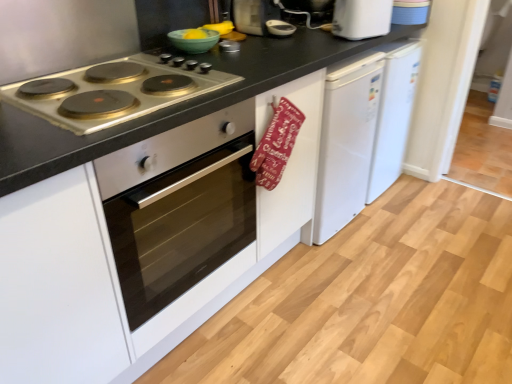
The height and width of the screenshot is (384, 512). What do you see at coordinates (361, 18) in the screenshot?
I see `white plastic toaster at upper right` at bounding box center [361, 18].

What do you see at coordinates (193, 41) in the screenshot? The image size is (512, 384). I see `green matte bowl at upper center` at bounding box center [193, 41].

Locate an element on the screen. white plastic toaster at upper right is located at coordinates (361, 18).

From the image's perspective, which object appears higher, white plastic toaster at upper right or red fabric oven mitt at center?

From the image's view, white plastic toaster at upper right is above.

From a real-world perspective, who is located lower, white plastic toaster at upper right or red fabric oven mitt at center?

From a 3D spatial view, red fabric oven mitt at center is below.

In the image, is white plastic toaster at upper right positioned in front of or behind red fabric oven mitt at center?

Visually, white plastic toaster at upper right is located behind red fabric oven mitt at center.

Is point (355, 32) more distant than point (257, 120)?

Yes, it is.

Considering the relative positions of white plastic toaster at upper right and satin silver oven at left in the image provided, is white plastic toaster at upper right to the left or to the right of satin silver oven at left?

Clearly, white plastic toaster at upper right is on the right of satin silver oven at left in the image.

Is white plastic toaster at upper right thinner than satin silver oven at left?

Correct, the width of white plastic toaster at upper right is less than that of satin silver oven at left.

Is point (376, 9) less distant than point (178, 155)?

No, (376, 9) is behind (178, 155).

Can you confirm if green matte bowl at upper center is bigger than satin silver oven at left?

Actually, green matte bowl at upper center might be smaller than satin silver oven at left.

Does green matte bowl at upper center have a lesser height compared to satin silver oven at left?

Yes, green matte bowl at upper center is shorter than satin silver oven at left.

Consider the image. Could you tell me if green matte bowl at upper center is facing satin silver oven at left?

No, green matte bowl at upper center does not turn towards satin silver oven at left.

The height and width of the screenshot is (384, 512). I want to click on bowl to the right of satin silver oven at left, so click(x=193, y=41).

Is red fabric oven mitt at center oriented away from metallic silver cooktop at left?

No, red fabric oven mitt at center is not facing the opposite direction of metallic silver cooktop at left.

Are red fabric oven mitt at center and metallic silver cooktop at left located far from each other?

red fabric oven mitt at center is near metallic silver cooktop at left, not far away.

Who is smaller, red fabric oven mitt at center or metallic silver cooktop at left?

metallic silver cooktop at left.

From the image's perspective, who appears lower, red fabric oven mitt at center or metallic silver cooktop at left?

red fabric oven mitt at center is shown below in the image.

Which object is closer to the camera taking this photo, red fabric oven mitt at center or green matte bowl at upper center?

Positioned in front is red fabric oven mitt at center.

From a real-world perspective, relative to green matte bowl at upper center, is red fabric oven mitt at center vertically above or below?

red fabric oven mitt at center is situated lower than green matte bowl at upper center in the real world.

Who is bigger, red fabric oven mitt at center or green matte bowl at upper center?

Bigger between the two is red fabric oven mitt at center.

Who is taller, satin silver oven at left or metallic silver cooktop at left?

satin silver oven at left.

What are the coordinates of `gas stove above the satin silver oven at left (from a real-world perspective)` in the screenshot? It's located at (114, 91).

Is satin silver oven at left situated inside metallic silver cooktop at left or outside?

satin silver oven at left is not inside metallic silver cooktop at left, it's outside.

How different are the orientations of metallic silver cooktop at left and satin silver oven at left in degrees?

metallic silver cooktop at left and satin silver oven at left are facing 0.931 degrees away from each other.

Is satin silver oven at left located within metallic silver cooktop at left?

That's incorrect, satin silver oven at left is not inside metallic silver cooktop at left.

Which is more to the left, metallic silver cooktop at left or satin silver oven at left?

Positioned to the left is metallic silver cooktop at left.

Is metallic silver cooktop at left turned away from satin silver oven at left?

No, metallic silver cooktop at left is not facing the opposite direction of satin silver oven at left.

In the image, there is a red fabric oven mitt at center. Where is `kitchen appliance above it (from the image's perspective)`? This screenshot has height=384, width=512. kitchen appliance above it (from the image's perspective) is located at coordinates (361, 18).

Find the location of `oven beneath the white plastic toaster at upper right (from a real-world perspective)`. oven beneath the white plastic toaster at upper right (from a real-world perspective) is located at coordinates (179, 207).

Based on their spatial positions, is red fabric oven mitt at center or satin silver oven at left closer to green matte bowl at upper center?

red fabric oven mitt at center is positioned closer to the anchor green matte bowl at upper center.

Looking at the image, which one is located further to satin silver oven at left, metallic silver cooktop at left or white plastic toaster at upper right?

white plastic toaster at upper right lies further to satin silver oven at left than the other object.

From the image, which object appears to be farther from satin silver oven at left, green matte bowl at upper center or metallic silver cooktop at left?

Among the two, green matte bowl at upper center is located further to satin silver oven at left.

From the image, which object appears to be nearer to satin silver oven at left, red fabric oven mitt at center or metallic silver cooktop at left?

The object closer to satin silver oven at left is red fabric oven mitt at center.

Estimate the real-world distances between objects in this image. Which object is further from white plastic toaster at upper right, satin silver oven at left or green matte bowl at upper center?

satin silver oven at left lies further to white plastic toaster at upper right than the other object.

Consider the image. From the image, which object appears to be farther from white plastic toaster at upper right, red fabric oven mitt at center or metallic silver cooktop at left?

The object further to white plastic toaster at upper right is metallic silver cooktop at left.

Estimate the real-world distances between objects in this image. Which object is closer to satin silver oven at left, green matte bowl at upper center or red fabric oven mitt at center?

red fabric oven mitt at center is closer to satin silver oven at left.

Based on their spatial positions, is red fabric oven mitt at center or green matte bowl at upper center closer to white plastic toaster at upper right?

Among the two, red fabric oven mitt at center is located nearer to white plastic toaster at upper right.

What are the coordinates of `cabinetry situated between satin silver oven at left and white plastic toaster at upper right from left to right` in the screenshot? It's located at (290, 164).

The height and width of the screenshot is (384, 512). What are the coordinates of `cabinetry located between green matte bowl at upper center and white plastic toaster at upper right in the left-right direction` in the screenshot? It's located at (290, 164).

I want to click on bowl situated between metallic silver cooktop at left and white plastic toaster at upper right from left to right, so click(x=193, y=41).

The image size is (512, 384). I want to click on cabinetry between satin silver oven at left and green matte bowl at upper center in the front-back direction, so click(290, 164).